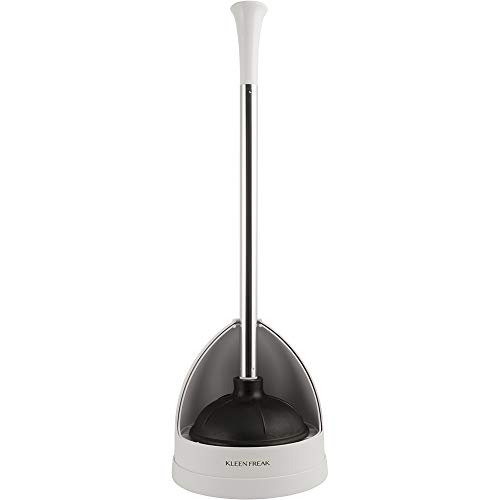
Image resolution: width=500 pixels, height=500 pixels. Identify the location of plunger. (249, 418).